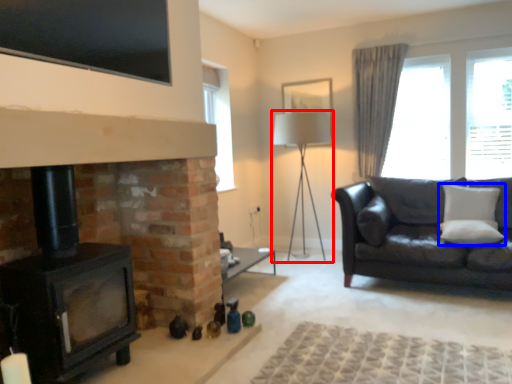
Question: Which of the following is the farthest to the observer, table lamp (highlighted by a red box) or pillow (highlighted by a blue box)?

Choices:
 (A) table lamp
 (B) pillow

Answer: (A)